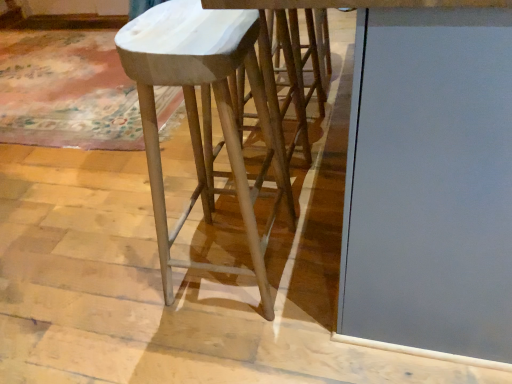
Where is `vacant area located to the right-hand side of white marble stool at center`? vacant area located to the right-hand side of white marble stool at center is located at coordinates (315, 251).